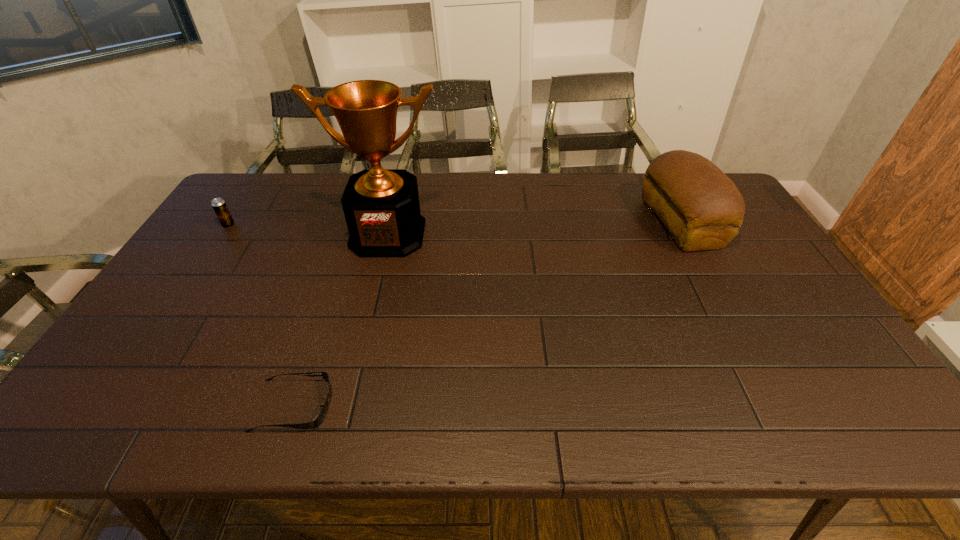
Image resolution: width=960 pixels, height=540 pixels. I want to click on the tallest object, so click(381, 206).

At what (x,y) coordinates should I click in order to perform the action: click on the second tallest object. Please return your answer as a coordinate pair (x, y). Looking at the image, I should click on (701, 207).

Find the location of a particular element. This screenshot has width=960, height=540. bread is located at coordinates (701, 207).

Identify the location of the third tallest object. The height and width of the screenshot is (540, 960). (223, 214).

Locate an element on the screen. This screenshot has height=540, width=960. the leftmost object is located at coordinates (223, 214).

The height and width of the screenshot is (540, 960). What are the coordinates of `sunglasses` in the screenshot? It's located at (320, 417).

The width and height of the screenshot is (960, 540). In order to click on the shortest object in this screenshot , I will do `click(320, 417)`.

At what (x,y) coordinates should I click in order to perform the action: click on free space located on the front of the tallest object with the label. Please return your answer as a coordinate pair (x, y). This screenshot has height=540, width=960. Looking at the image, I should click on (364, 333).

Where is `blank space located on the front of the third shortest object`? blank space located on the front of the third shortest object is located at coordinates (716, 288).

This screenshot has height=540, width=960. I want to click on free location located 0.300m on the front of the second shortest object, so coord(181,295).